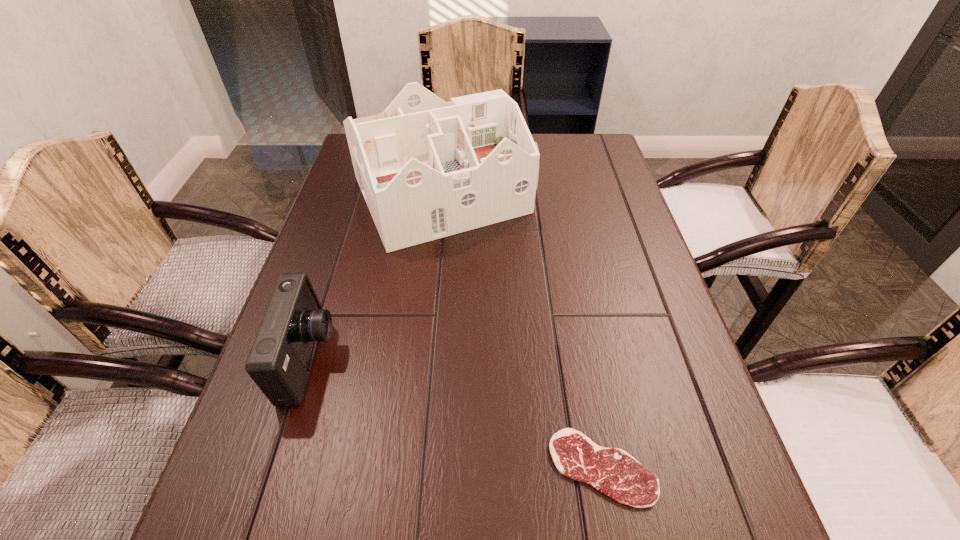
At what (x,y) coordinates should I click in order to perform the action: click on dollhouse. Please return your answer as a coordinate pair (x, y). Looking at the image, I should click on (428, 169).

Identify the location of the tallest object. The height and width of the screenshot is (540, 960). (428, 169).

Where is `camera`? camera is located at coordinates (280, 360).

Where is `the second tallest object`? the second tallest object is located at coordinates (280, 360).

Where is `the nearest object`? The height and width of the screenshot is (540, 960). the nearest object is located at coordinates (612, 471).

This screenshot has width=960, height=540. What are the coordinates of `the shortest object` in the screenshot? It's located at (612, 471).

I want to click on free spot located 0.170m on the front of the farthest object, so click(x=432, y=306).

Locate an element on the screen. The width and height of the screenshot is (960, 540). vacant space located 0.320m on the front-facing side of the second tallest object is located at coordinates (494, 360).

The image size is (960, 540). I want to click on vacant space located 0.230m on the left of the steak, so click(412, 467).

Where is `object that is at the far edge`? object that is at the far edge is located at coordinates (428, 169).